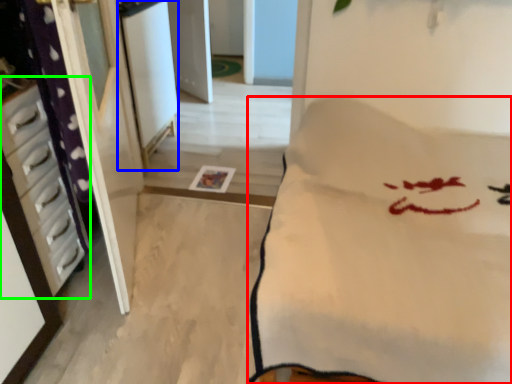
Question: Which is farther away from furniture (highlighted by a red box)? screen door (highlighted by a blue box) or furniture (highlighted by a green box)?

Choices:
 (A) screen door
 (B) furniture

Answer: (A)